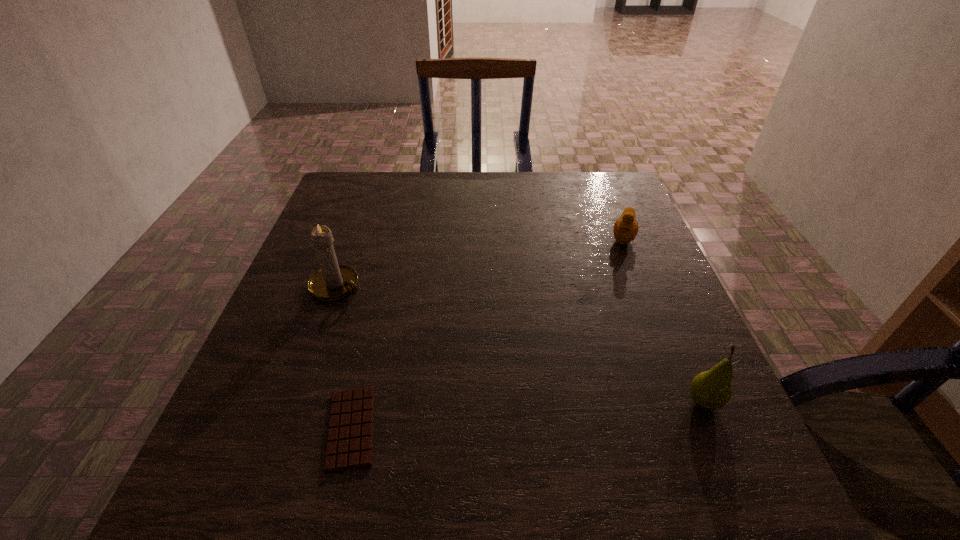
This screenshot has width=960, height=540. I want to click on vacant space located on the face of the farthest object, so click(605, 330).

Identify the location of free space located 0.370m on the face of the farthest object. This screenshot has width=960, height=540. (598, 359).

Where is `free space located 0.120m on the handle side of the leftmost object`? free space located 0.120m on the handle side of the leftmost object is located at coordinates (394, 318).

Where is `free space located 0.130m on the handle side of the leftmost object`? This screenshot has width=960, height=540. free space located 0.130m on the handle side of the leftmost object is located at coordinates (397, 320).

You are a GUI agent. You are given a task and a screenshot of the screen. Output one action in this format:
    pyautogui.click(x=<x>, y=<y>)
    Task: Click on the vacant space located 0.120m on the handle side of the leftmost object
    The height and width of the screenshot is (540, 960).
    Given the screenshot: What is the action you would take?
    pyautogui.click(x=394, y=318)

Where is `candy bar present at the near edge`? The height and width of the screenshot is (540, 960). candy bar present at the near edge is located at coordinates (349, 445).

In order to click on pear present at the near edge in this screenshot , I will do `click(711, 390)`.

In order to click on object that is positioned at the left edge in this screenshot , I will do `click(332, 282)`.

This screenshot has width=960, height=540. Find the location of `pear situated at the right edge`. pear situated at the right edge is located at coordinates (711, 390).

At what (x,y) coordinates should I click in order to perform the action: click on duckling located in the right edge section of the desktop. Please return your answer as a coordinate pair (x, y). This screenshot has height=540, width=960. Looking at the image, I should click on (625, 230).